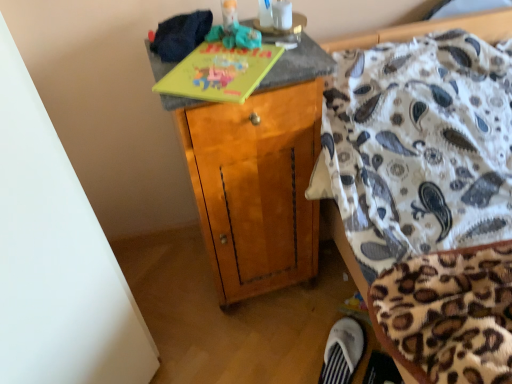
Question: From the image's perspective, does yellow matte book at upper center appear lower than wooden cabinet at center?

Choices:
 (A) yes
 (B) no

Answer: (B)

Question: Is yellow matte book at upper center taller than wooden cabinet at center?

Choices:
 (A) yes
 (B) no

Answer: (B)

Question: Is yellow matte book at upper center positioned beyond the bounds of wooden cabinet at center?

Choices:
 (A) no
 (B) yes

Answer: (A)

Question: Can you confirm if yellow matte book at upper center is thinner than wooden cabinet at center?

Choices:
 (A) no
 (B) yes

Answer: (B)

Question: From a real-world perspective, is yellow matte book at upper center on wooden cabinet at center?

Choices:
 (A) yes
 (B) no

Answer: (A)

Question: From a real-world perspective, is yellow matte book at upper center positioned under wooden cabinet at center based on gravity?

Choices:
 (A) yes
 (B) no

Answer: (B)

Question: Is rubberized green toy at upper center positioned beyond the bounds of white fabric slipper at lower right?

Choices:
 (A) no
 (B) yes

Answer: (B)

Question: Is rubberized green toy at upper center bigger than white fabric slipper at lower right?

Choices:
 (A) no
 (B) yes

Answer: (A)

Question: From a real-world perspective, does rubberized green toy at upper center stand above white fabric slipper at lower right?

Choices:
 (A) yes
 (B) no

Answer: (A)

Question: Does rubberized green toy at upper center come behind white fabric slipper at lower right?

Choices:
 (A) yes
 (B) no

Answer: (B)

Question: Can you confirm if rubberized green toy at upper center is wider than white fabric slipper at lower right?

Choices:
 (A) no
 (B) yes

Answer: (A)

Question: Considering the relative sizes of rubberized green toy at upper center and white fabric slipper at lower right in the image provided, is rubberized green toy at upper center taller than white fabric slipper at lower right?

Choices:
 (A) no
 (B) yes

Answer: (A)

Question: From the image's perspective, does wooden cabinet at center appear higher than yellow matte book at upper center?

Choices:
 (A) no
 (B) yes

Answer: (A)